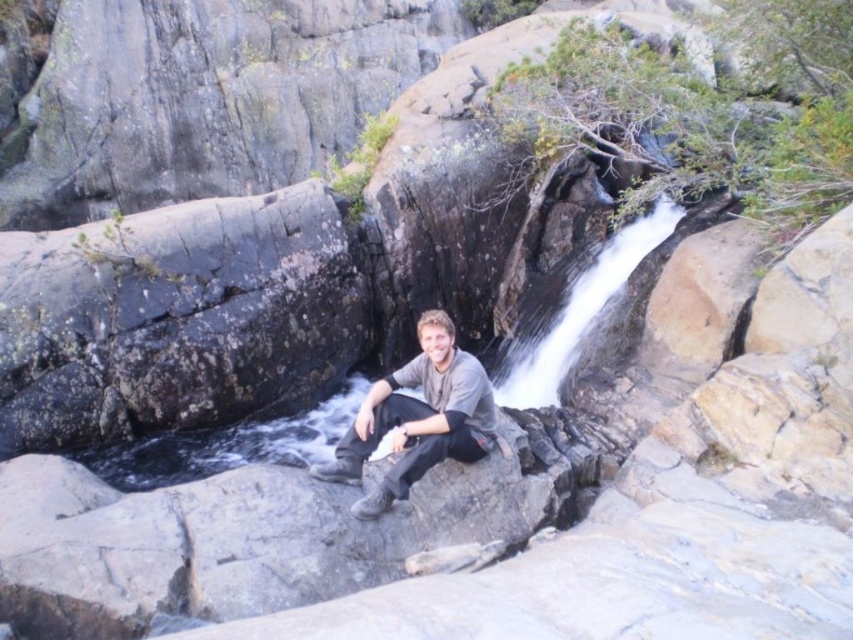
You are standing in the scene and want to cross the smooth rock creek at center. The gray matte shirt at center is your friend who is sitting on a rocky ledge. Which direction should you move relative to your friend to reach the creek?

You should move to the right of the gray matte shirt at center because the smooth rock creek at center is located to the right of the gray matte shirt at center.

You are a hiker who wants to cross the smooth rock creek at center. Based on the coordinates provided, can you determine if the creek is in the middle of the image?

The smooth rock creek at center is located at coordinates point (570,310), which is very close to the center of the image, so yes, it is in the middle of the image.